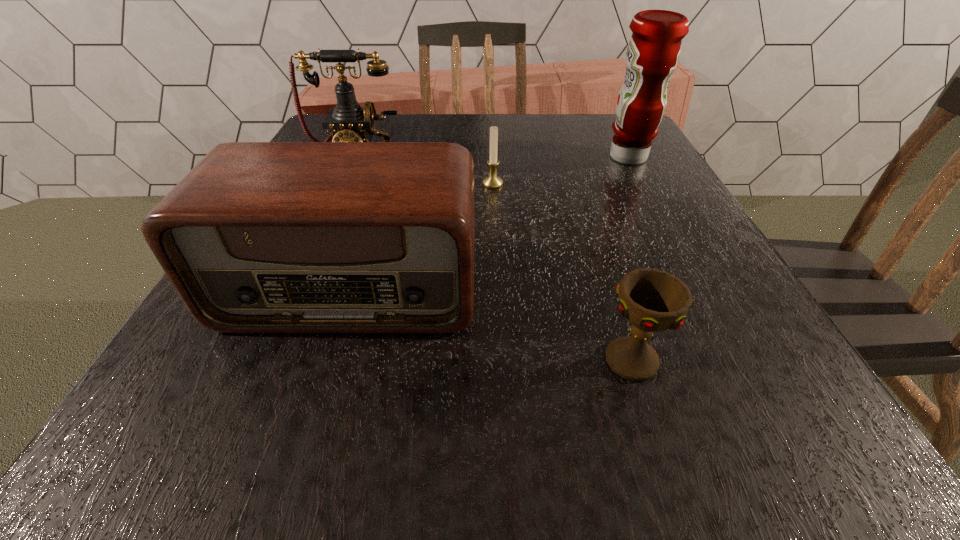
The image size is (960, 540). I want to click on free space at the far edge of the desktop, so click(x=463, y=137).

At what (x,y) coordinates should I click in order to perform the action: click on free space at the near edge. Please return your answer as a coordinate pair (x, y). Looking at the image, I should click on (522, 420).

The image size is (960, 540). Find the location of `vacant region at the right edge of the desktop`. vacant region at the right edge of the desktop is located at coordinates (703, 235).

Find the location of a particular element. Image resolution: width=960 pixels, height=540 pixels. vacant space at the near left corner of the desktop is located at coordinates (137, 413).

In the image, there is a desktop. Where is `blank space at the near right corner`? The height and width of the screenshot is (540, 960). blank space at the near right corner is located at coordinates (x=818, y=465).

Where is `blank region between the chalice and the telephone`? The image size is (960, 540). blank region between the chalice and the telephone is located at coordinates (493, 259).

Find the location of a particular element. The height and width of the screenshot is (540, 960). blank region between the candle holder and the tallest object is located at coordinates (561, 171).

At what (x,y) coordinates should I click in order to perform the action: click on empty space between the chalice and the condiment. Please return your answer as a coordinate pair (x, y). The image size is (960, 540). Looking at the image, I should click on (630, 259).

At what (x,y) coordinates should I click in order to perform the action: click on free space between the tallest object and the candle holder. Please return your answer as a coordinate pair (x, y). This screenshot has height=540, width=960. Looking at the image, I should click on (561, 171).

Identify the location of free space between the candle holder and the condiment. pos(561,171).